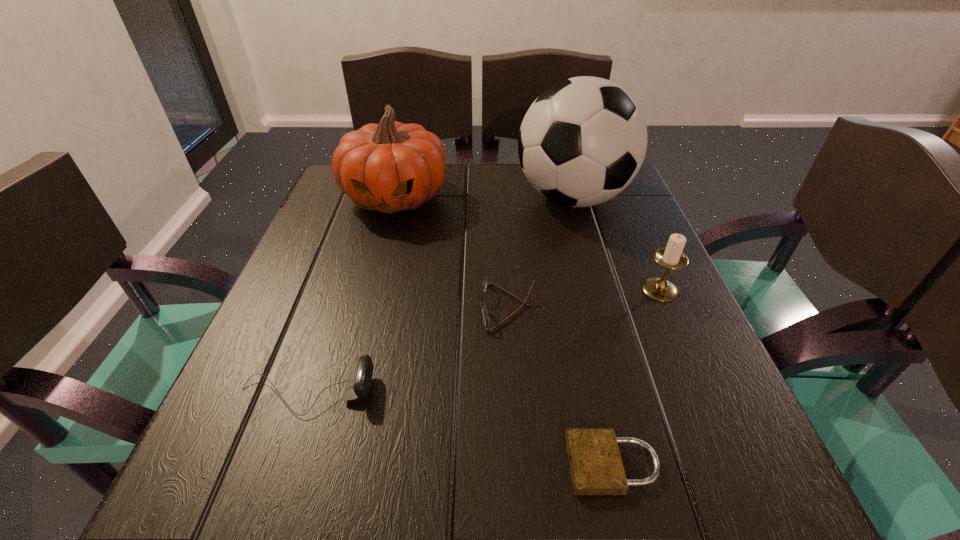
This screenshot has width=960, height=540. What are the coordinates of `free location at the near edge` in the screenshot? It's located at (569, 515).

Locate an element on the screen. The image size is (960, 540). vacant space at the left edge is located at coordinates (224, 438).

Find the location of `vacant space at the right edge of the desktop`. vacant space at the right edge of the desktop is located at coordinates (635, 244).

Find the location of a particular element. The height and width of the screenshot is (540, 960). vacant space at the far left corner of the desktop is located at coordinates (327, 207).

At what (x,y) coordinates should I click in order to perform the action: click on vacant region at the far right corner of the desktop. Please return your answer as a coordinate pair (x, y). The height and width of the screenshot is (540, 960). Looking at the image, I should click on (624, 205).

What are the coordinates of `free region at the near right corner` in the screenshot? It's located at (752, 497).

I want to click on vacant area that lies between the tallest object and the second tallest object, so click(x=484, y=198).

Locate an element on the screen. This screenshot has width=960, height=540. empty space between the fifth shortest object and the shortest object is located at coordinates (504, 331).

Locate an element on the screen. The height and width of the screenshot is (540, 960). free space between the shortest object and the fourth shortest object is located at coordinates (636, 377).

The width and height of the screenshot is (960, 540). I want to click on vacant region between the second tallest object and the webcam, so click(351, 295).